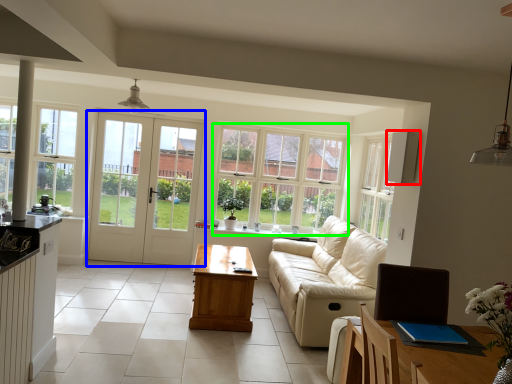
Question: Considering the real-world distances, which object is farthest from appliance (highlighted by a red box)? door (highlighted by a blue box) or window (highlighted by a green box)?

Choices:
 (A) door
 (B) window

Answer: (A)